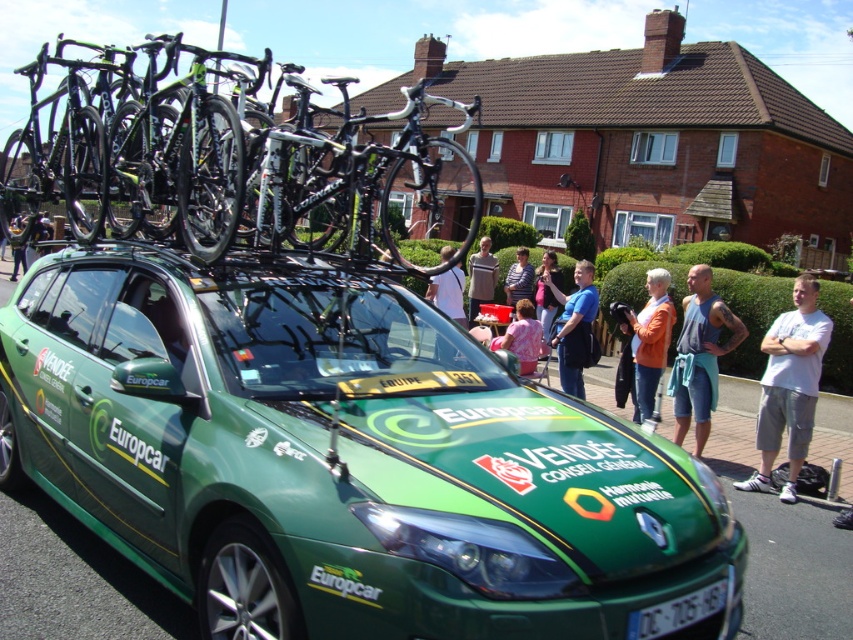
Question: Is blue fabric shorts at center to the right of blue fabric shirt at center from the viewer's perspective?

Choices:
 (A) yes
 (B) no

Answer: (A)

Question: Is striped cotton shirt at center positioned before dark blue jeans at center?

Choices:
 (A) yes
 (B) no

Answer: (B)

Question: From the image, what is the correct spatial relationship of shiny black bike at center in relation to orange fabric jacket at center?

Choices:
 (A) left
 (B) right

Answer: (A)

Question: Which point appears closest to the camera in this image?

Choices:
 (A) (525, 288)
 (B) (689, 282)

Answer: (B)

Question: Among these points, which one is nearest to the camera?

Choices:
 (A) (10, 278)
 (B) (553, 628)
 (C) (636, 621)
 (D) (566, 360)

Answer: (B)

Question: Which object is positioned farthest from the green matte car at center?

Choices:
 (A) shiny black bike at center
 (B) striped shirt at center
 (C) blue fabric shorts at center
 (D) orange fabric jacket at center

Answer: (B)